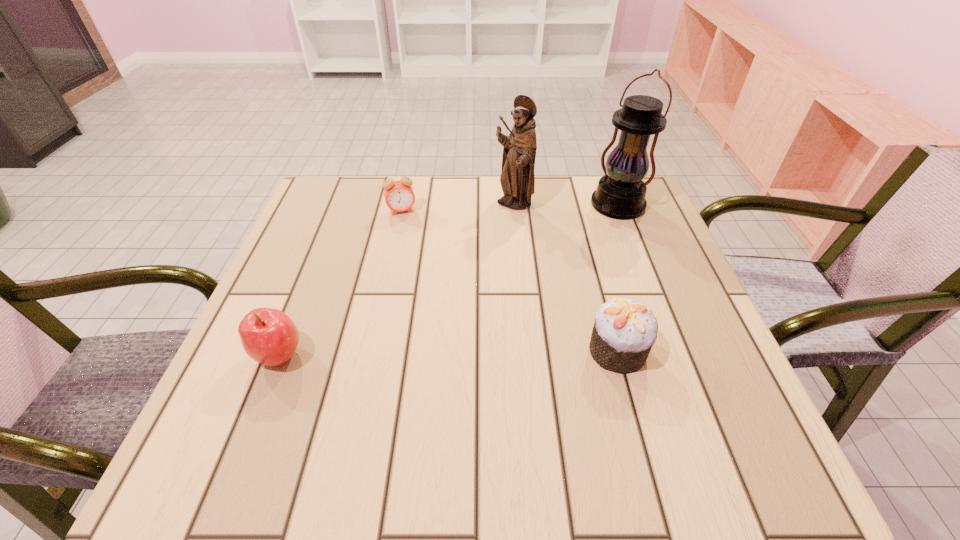
Identify the location of free space between the fourth shortest object and the apple. (396, 280).

Identify the location of free space that is in between the lantern and the apple. This screenshot has width=960, height=540. (448, 280).

You are a GUI agent. You are given a task and a screenshot of the screen. Output one action in this format:
    pyautogui.click(x=<x>, y=<y>)
    Task: Click on the vacant point located between the tallest object and the third object from left to right
    
    Given the screenshot: What is the action you would take?
    pyautogui.click(x=565, y=205)

Identify the location of unoccupied area between the third object from right to left and the lantern. (565, 205).

Point out which object is positioned as the nearest to the figurine. Please provide its 2D coordinates. Your answer should be formatted as a tuple, i.e. [(x, y)], where the tuple contains the x and y coordinates of a point satisfying the conditions above.

[(620, 194)]

Find the location of a particular element. This screenshot has width=960, height=540. object that ranks as the fourth closest to the cupcake is located at coordinates (268, 336).